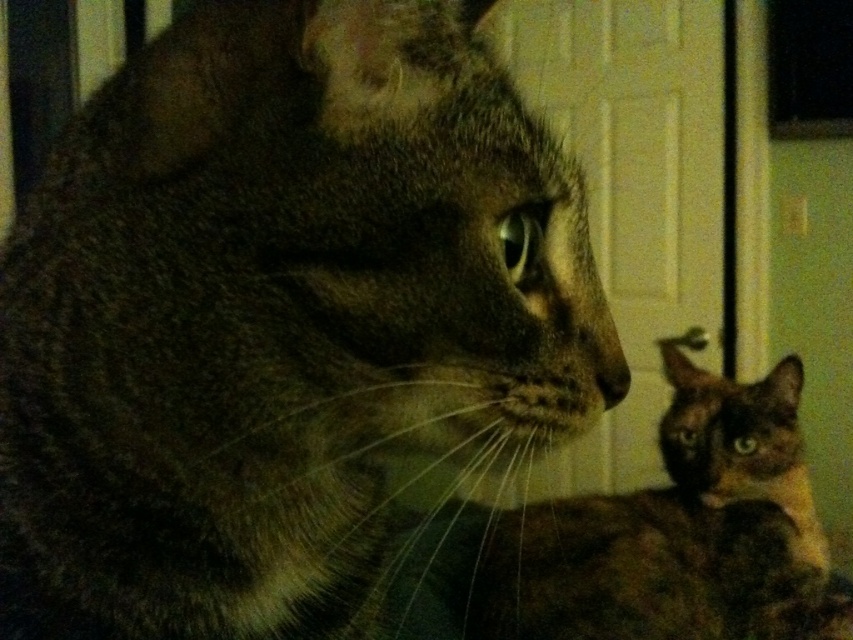
Between dark brown fur cat at left and brown fur cat at lower right, which one is positioned higher?

dark brown fur cat at left is above.

Does dark brown fur cat at left appear on the left side of brown fur cat at lower right?

Correct, you'll find dark brown fur cat at left to the left of brown fur cat at lower right.

The image size is (853, 640). What do you see at coordinates (277, 317) in the screenshot? I see `dark brown fur cat at left` at bounding box center [277, 317].

Locate an element on the screen. Image resolution: width=853 pixels, height=640 pixels. dark brown fur cat at left is located at coordinates (277, 317).